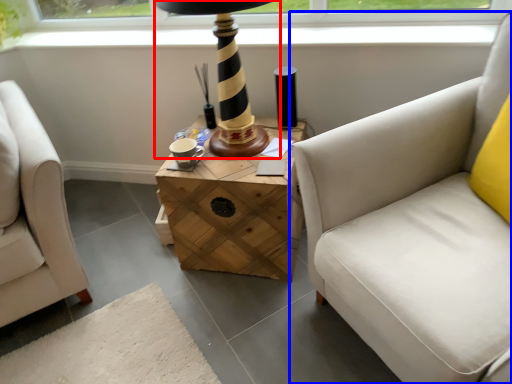
Question: Which of the following is the farthest to the observer, table lamp (highlighted by a red box) or studio couch (highlighted by a blue box)?

Choices:
 (A) table lamp
 (B) studio couch

Answer: (A)